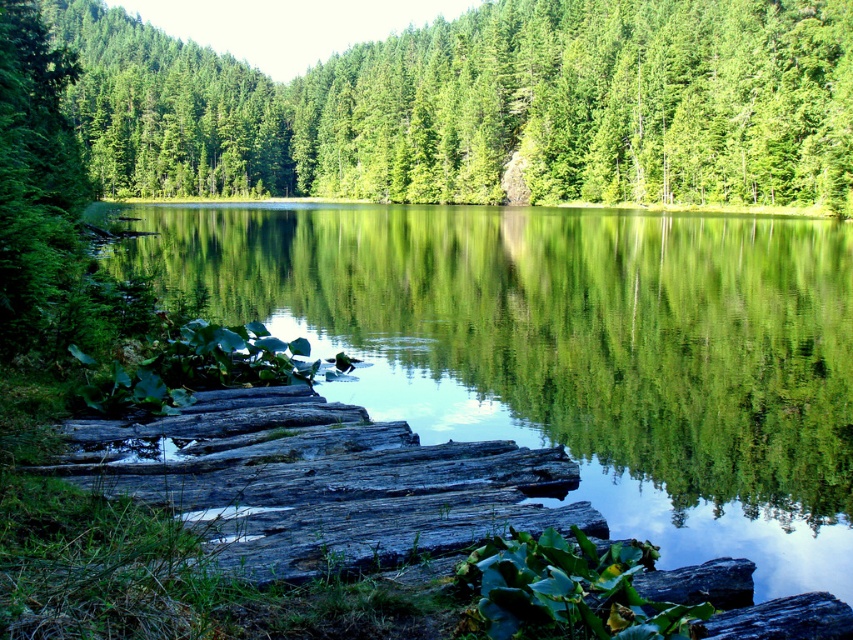
Question: Can you confirm if smooth wooden dock at center is bigger than green matte tree at center?

Choices:
 (A) yes
 (B) no

Answer: (B)

Question: Which point is closer to the camera taking this photo?

Choices:
 (A) (781, 241)
 (B) (376, 134)

Answer: (A)

Question: Which of the following is the closest to the observer?

Choices:
 (A) (358, 90)
 (B) (398, 237)

Answer: (B)

Question: Which point is farther from the camera taking this photo?

Choices:
 (A) (463, 339)
 (B) (293, 164)

Answer: (B)

Question: Is smooth wooden dock at center wider than green matte tree at center?

Choices:
 (A) yes
 (B) no

Answer: (B)

Question: Can you confirm if smooth wooden dock at center is smaller than green matte tree at center?

Choices:
 (A) no
 (B) yes

Answer: (B)